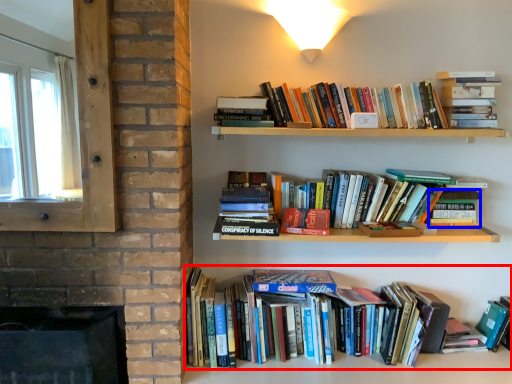
Question: Among these objects, which one is farthest to the camera, book (highlighted by a red box) or paperback book (highlighted by a blue box)?

Choices:
 (A) book
 (B) paperback book

Answer: (B)